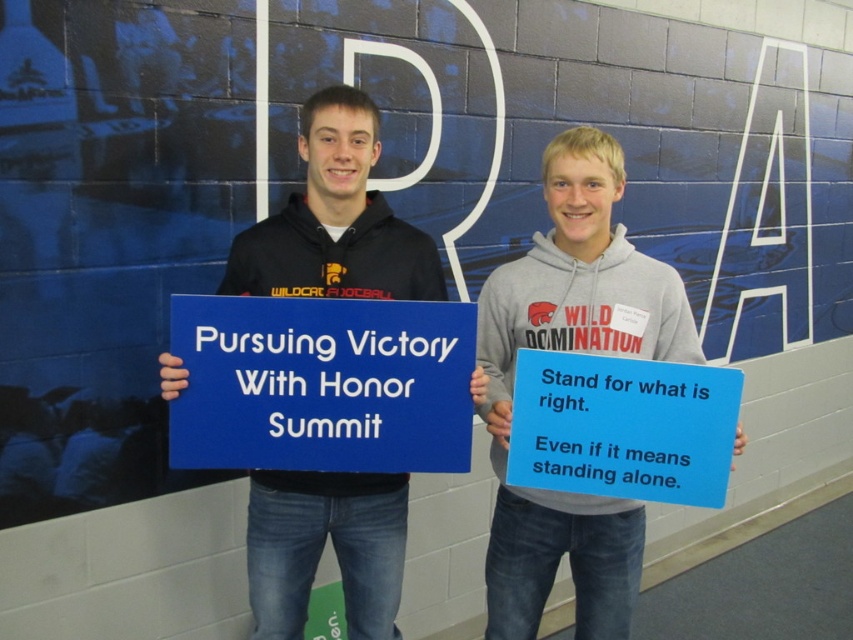
Question: Can you confirm if blue matte sign at center is positioned above matte black hoodie at center?

Choices:
 (A) yes
 (B) no

Answer: (A)

Question: Which point is farther from the camera taking this photo?

Choices:
 (A) (717, 460)
 (B) (169, 323)

Answer: (B)

Question: Which object is the closest to the blue cardstock sign at center?

Choices:
 (A) matte black hoodie at center
 (B) gray hoodie at center
 (C) blue matte sign at center

Answer: (B)

Question: Is blue matte sign at center wider than matte black hoodie at center?

Choices:
 (A) no
 (B) yes

Answer: (B)

Question: Can you confirm if blue matte sign at center is thinner than blue cardstock sign at center?

Choices:
 (A) no
 (B) yes

Answer: (A)

Question: Which object is closer to the camera taking this photo?

Choices:
 (A) blue cardstock sign at center
 (B) matte black hoodie at center
 (C) blue matte sign at center

Answer: (C)